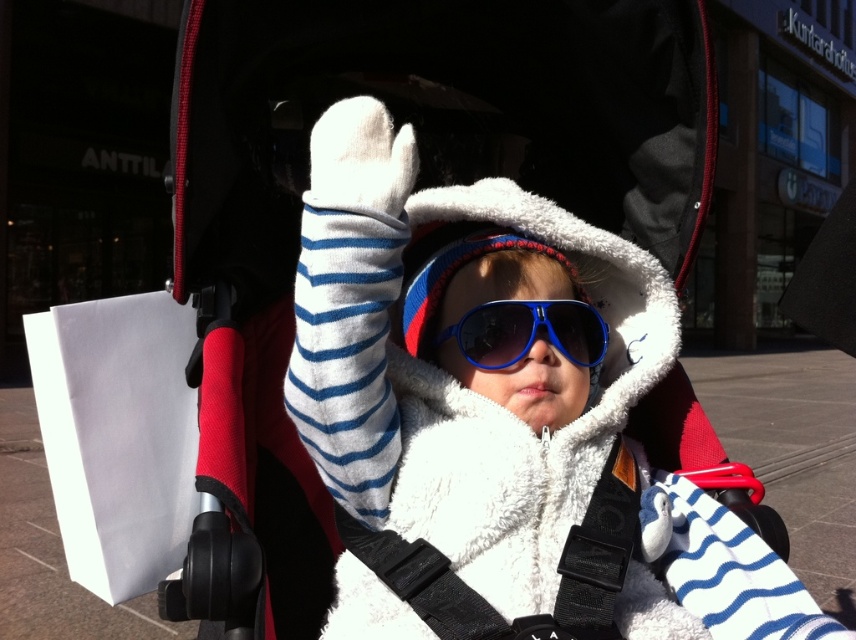
Question: Is black fabric strap at center to the left of blue plastic goggles at center from the viewer's perspective?

Choices:
 (A) yes
 (B) no

Answer: (A)

Question: Which of the following is the closest to the observer?

Choices:
 (A) blue plastic goggles at center
 (B) black fabric strap at center

Answer: (B)

Question: Which object is closer to the camera taking this photo?

Choices:
 (A) blue plastic goggles at center
 (B) black fabric strap at center

Answer: (B)

Question: In this image, where is black fabric strap at center located relative to blue plastic goggles at center?

Choices:
 (A) right
 (B) left

Answer: (B)

Question: Is black fabric strap at center wider than blue plastic goggles at center?

Choices:
 (A) yes
 (B) no

Answer: (A)

Question: Which object is farther from the camera taking this photo?

Choices:
 (A) black fabric strap at center
 (B) blue plastic goggles at center

Answer: (B)